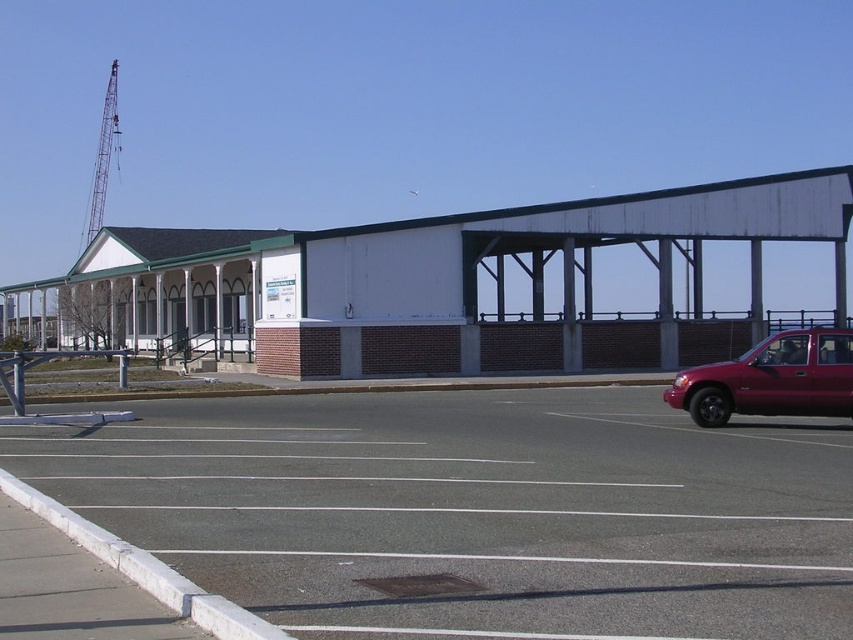
Consider the image. You are standing at the entrance of the building and notice two points marked on the parking lot. The first point is at coordinates point (94,512) and the second is at point (735,394). Which point is closer to the entrance of the building?

Point (94,512) is closer to the entrance of the building because it is in front of point (735,394).